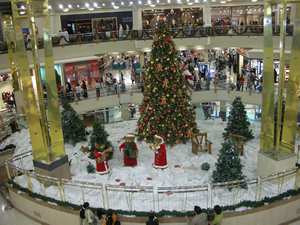
This screenshot has width=300, height=225. I want to click on christmas tree, so click(226, 163), click(163, 112), click(97, 134), click(71, 124).